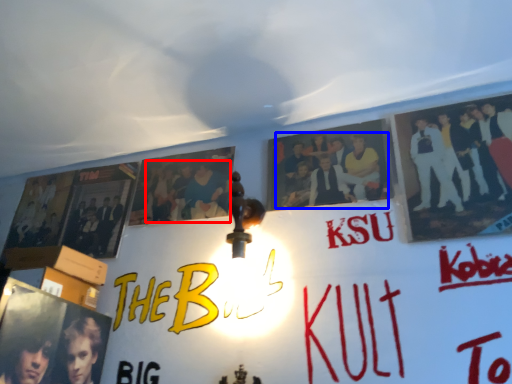
Question: Which of the following is the farthest to the observer, person (highlighted by a red box) or person (highlighted by a blue box)?

Choices:
 (A) person
 (B) person

Answer: (A)